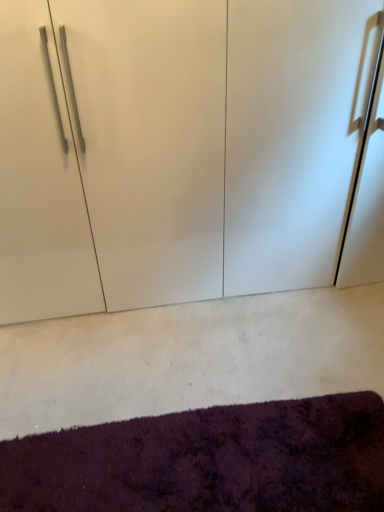
Question: Can we say white glossy cupboard at center lies outside shaggy purple mat at lower center?

Choices:
 (A) no
 (B) yes

Answer: (B)

Question: Is there a large distance between white glossy cupboard at center and shaggy purple mat at lower center?

Choices:
 (A) yes
 (B) no

Answer: (B)

Question: Considering the relative sizes of white glossy cupboard at center and shaggy purple mat at lower center in the image provided, is white glossy cupboard at center smaller than shaggy purple mat at lower center?

Choices:
 (A) yes
 (B) no

Answer: (B)

Question: Is white glossy cupboard at center shorter than shaggy purple mat at lower center?

Choices:
 (A) yes
 (B) no

Answer: (B)

Question: Does white glossy cupboard at center have a greater width compared to shaggy purple mat at lower center?

Choices:
 (A) yes
 (B) no

Answer: (A)

Question: Can you confirm if white glossy cupboard at center is bigger than shaggy purple mat at lower center?

Choices:
 (A) yes
 (B) no

Answer: (A)

Question: Is shaggy purple mat at lower center positioned in front of white glossy cupboard at center?

Choices:
 (A) no
 (B) yes

Answer: (B)

Question: Considering the relative sizes of shaggy purple mat at lower center and white glossy cupboard at center in the image provided, is shaggy purple mat at lower center taller than white glossy cupboard at center?

Choices:
 (A) yes
 (B) no

Answer: (B)

Question: From the image's perspective, is shaggy purple mat at lower center on top of white glossy cupboard at center?

Choices:
 (A) yes
 (B) no

Answer: (B)

Question: Is shaggy purple mat at lower center oriented towards white glossy cupboard at center?

Choices:
 (A) no
 (B) yes

Answer: (A)

Question: Considering the relative sizes of shaggy purple mat at lower center and white glossy cupboard at center in the image provided, is shaggy purple mat at lower center wider than white glossy cupboard at center?

Choices:
 (A) yes
 (B) no

Answer: (B)

Question: From a real-world perspective, is shaggy purple mat at lower center beneath white glossy cupboard at center?

Choices:
 (A) yes
 (B) no

Answer: (A)

Question: Is shaggy purple mat at lower center to the left or to the right of white glossy cupboard at center in the image?

Choices:
 (A) right
 (B) left

Answer: (B)